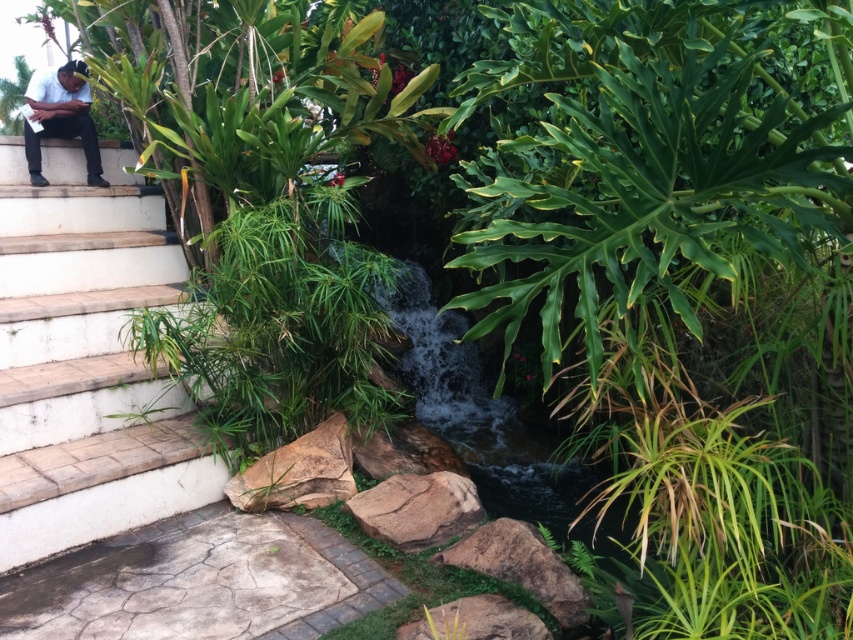
You are a gardener planning to place a 1.2 meter wide decorative planter between the white stone stairs at left and the black matte clothing at left. Based on their widths, will the planter fit between them?

The white stone stairs at left might be wider than black matte clothing at left, so the 1.2 meter wide decorative planter may or may not fit between them depending on the exact width of the stairs.

You are a landscape architect designing a pathway next to the white stone stairs at left and the black matte clothing at left. Which object should you consider in terms of size when planning the pathway width?

The white stone stairs at left is larger in size than the black matte clothing at left, so you should consider the white stone stairs at left when planning the pathway width to ensure adequate space around it.

You are a delivery person who needs to place a small package on the white stone stairs at left without getting the black matte clothing at left wet. Can you do this?

The white stone stairs at left is 39.23 inches away from the black matte clothing at left. Since 39.23 inches is more than enough space to place the package without disturbing the clothing, yes, you can safely do so.